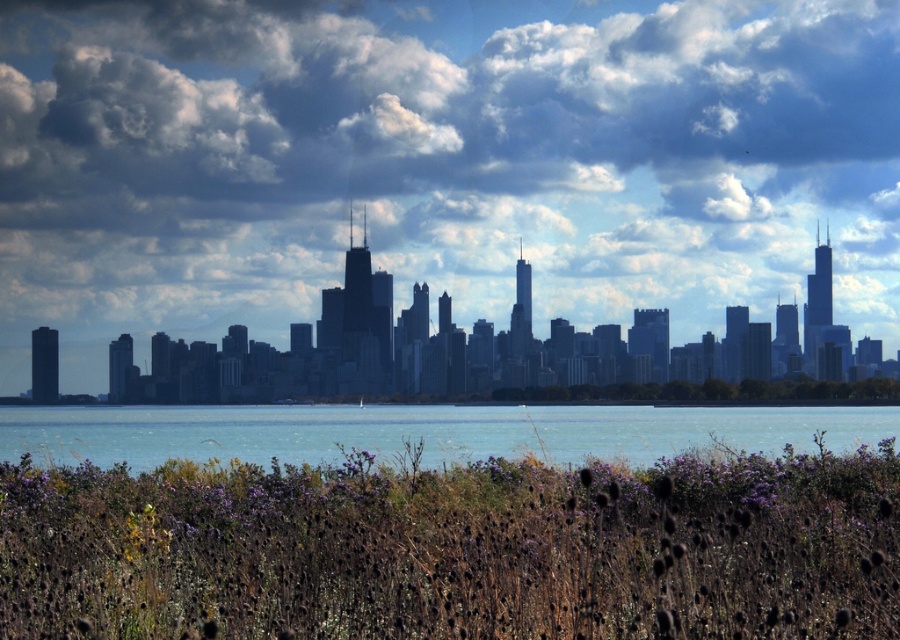
Question: Considering the real-world distances, which object is closest to the cloudy sky at upper center?

Choices:
 (A) purple dry grass at lower center
 (B) blue water at center

Answer: (B)

Question: Which is nearer to the blue water at center?

Choices:
 (A) purple dry grass at lower center
 (B) cloudy sky at upper center

Answer: (B)

Question: Is cloudy sky at upper center thinner than blue water at center?

Choices:
 (A) yes
 (B) no

Answer: (B)

Question: Is purple dry grass at lower center below blue water at center?

Choices:
 (A) no
 (B) yes

Answer: (A)

Question: Can you confirm if cloudy sky at upper center is positioned below blue water at center?

Choices:
 (A) yes
 (B) no

Answer: (B)

Question: Which of the following is the farthest from the observer?

Choices:
 (A) (202, 244)
 (B) (335, 422)
 (C) (130, 612)

Answer: (A)